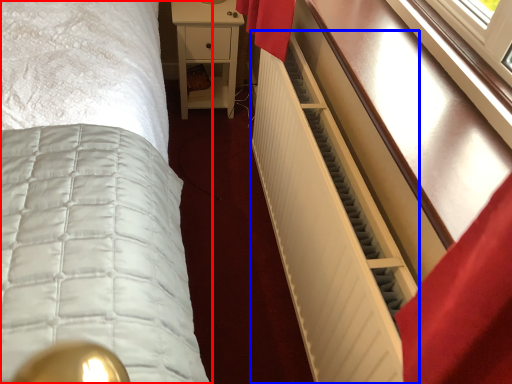
Question: Which object appears closest to the camera in this image, bed (highlighted by a red box) or radiator (highlighted by a blue box)?

Choices:
 (A) bed
 (B) radiator

Answer: (B)